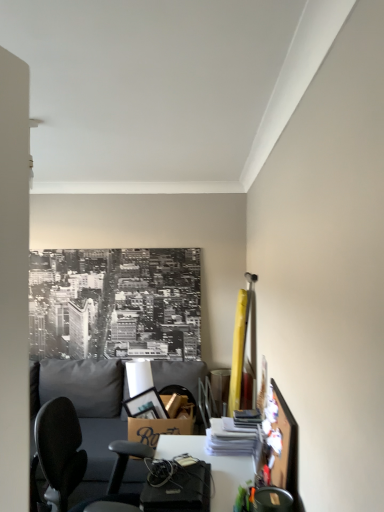
Question: Considering the relative sizes of metallic gray chair at lower right and gray fabric couch at lower left in the image provided, is metallic gray chair at lower right taller than gray fabric couch at lower left?

Choices:
 (A) yes
 (B) no

Answer: (B)

Question: Is metallic gray chair at lower right far away from gray fabric couch at lower left?

Choices:
 (A) yes
 (B) no

Answer: (A)

Question: Does metallic gray chair at lower right have a greater width compared to gray fabric couch at lower left?

Choices:
 (A) yes
 (B) no

Answer: (B)

Question: Is the surface of metallic gray chair at lower right in direct contact with gray fabric couch at lower left?

Choices:
 (A) yes
 (B) no

Answer: (B)

Question: Considering the relative positions of metallic gray chair at lower right and gray fabric couch at lower left in the image provided, is metallic gray chair at lower right behind gray fabric couch at lower left?

Choices:
 (A) yes
 (B) no

Answer: (B)

Question: Is point (173, 448) closer or farther from the camera than point (158, 418)?

Choices:
 (A) farther
 (B) closer

Answer: (B)

Question: In terms of height, does white glossy desk at center look taller or shorter compared to brown cardboard box at center?

Choices:
 (A) short
 (B) tall

Answer: (B)

Question: Considering the positions of white glossy desk at center and brown cardboard box at center in the image, is white glossy desk at center wider or thinner than brown cardboard box at center?

Choices:
 (A) thin
 (B) wide

Answer: (B)

Question: Considering their positions, is white glossy desk at center located in front of or behind brown cardboard box at center?

Choices:
 (A) behind
 (B) front

Answer: (B)

Question: Considering the positions of point (132, 437) and point (259, 507), is point (132, 437) closer or farther from the camera than point (259, 507)?

Choices:
 (A) closer
 (B) farther

Answer: (B)

Question: From a real-world perspective, relative to metallic gray chair at lower right, is brown cardboard box at center vertically above or below?

Choices:
 (A) above
 (B) below

Answer: (B)

Question: Would you say brown cardboard box at center is to the left or to the right of metallic gray chair at lower right in the picture?

Choices:
 (A) left
 (B) right

Answer: (A)

Question: Is brown cardboard box at center inside or outside of metallic gray chair at lower right?

Choices:
 (A) outside
 (B) inside

Answer: (A)

Question: Based on their positions, is brown cardboard box at center located to the left or right of white glossy desk at center?

Choices:
 (A) right
 (B) left

Answer: (B)

Question: From a real-world perspective, is brown cardboard box at center positioned above or below white glossy desk at center?

Choices:
 (A) below
 (B) above

Answer: (B)